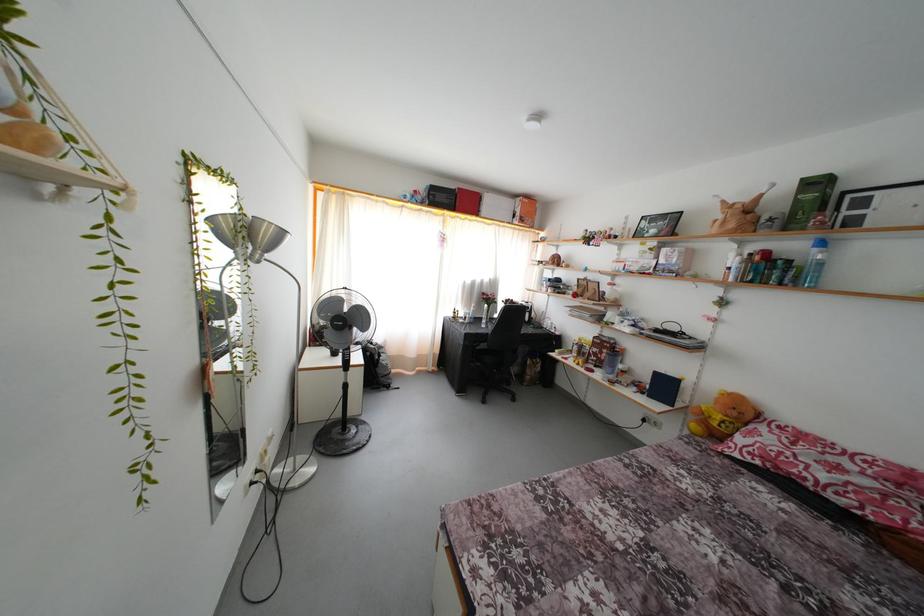
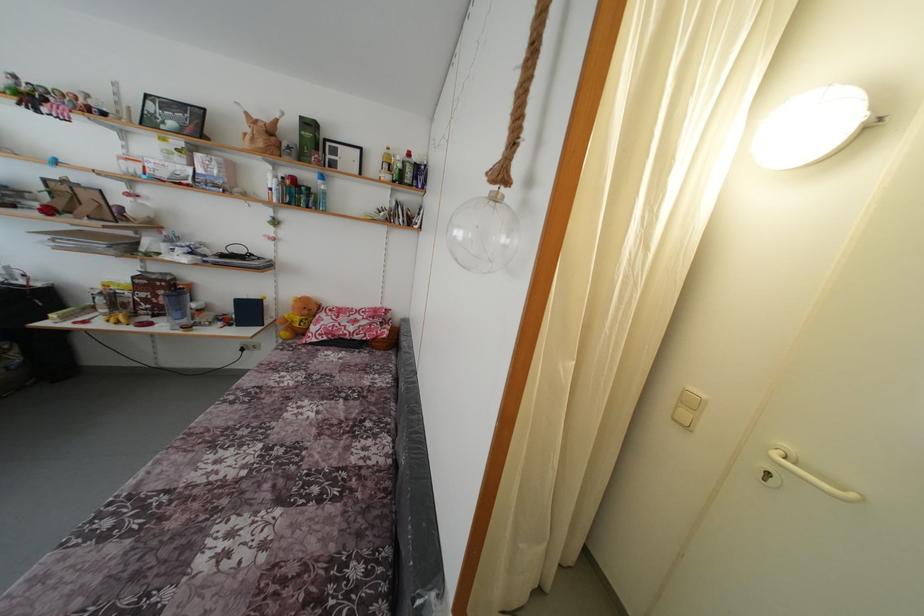
Where in the second image is the point corresponding to point (821, 256) from the first image?

(324, 188)